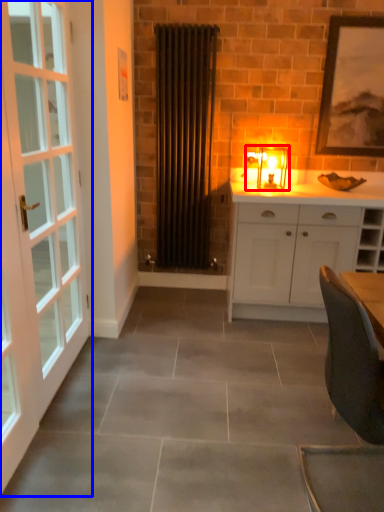
Question: Which point is further to the camera, light fixture (highlighted by a red box) or door (highlighted by a blue box)?

Choices:
 (A) light fixture
 (B) door

Answer: (A)